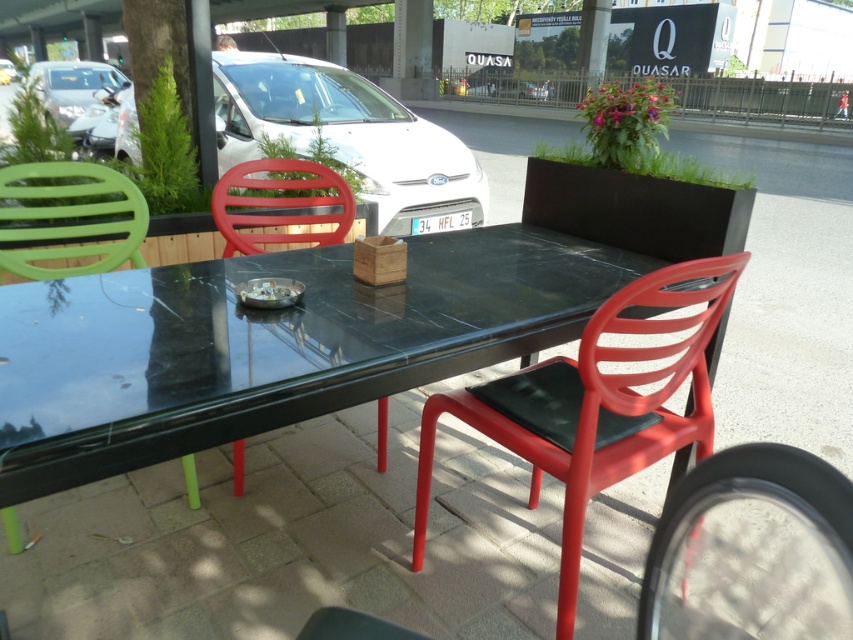
Where is `white glossy car at upper center`? white glossy car at upper center is located at coordinates (349, 138).

Is white glossy car at upper center smaller than matte green chair at left?

No.

Does point (302, 141) come closer to viewer compared to point (86, 234)?

No, (302, 141) is behind (86, 234).

Image resolution: width=853 pixels, height=640 pixels. Identify the location of white glossy car at upper center. (349, 138).

What do you see at coordinates (267, 344) in the screenshot?
I see `glossy black table at center` at bounding box center [267, 344].

Find the location of a particular element. glossy black table at center is located at coordinates (267, 344).

Does white glossy car at upper center have a larger size compared to green plastic chair at left?

Yes, white glossy car at upper center is bigger than green plastic chair at left.

Is white glossy car at upper center further to the viewer compared to green plastic chair at left?

Yes.

Locate an element on the screen. white glossy car at upper center is located at coordinates (349, 138).